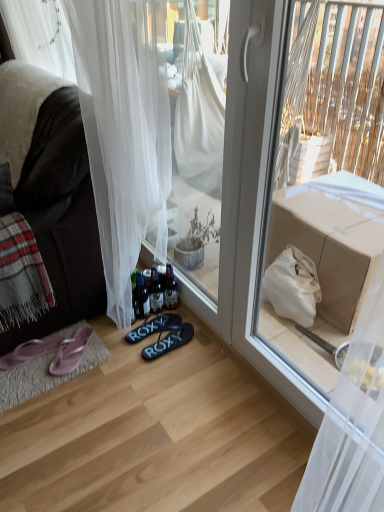
This screenshot has height=512, width=384. I want to click on blank space situated above pink fabric flip-flops at lower left, which is the 2th footwear in left-to-right order (from a real-world perspective), so click(x=72, y=343).